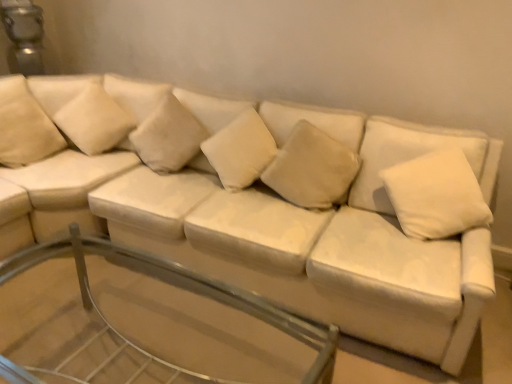
Question: Does suede-like beige pillow at upper left, the 1th pillow when ordered from left to right, appear on the left side of white soft cushion at upper left, the 5th pillow viewed from the right?

Choices:
 (A) yes
 (B) no

Answer: (A)

Question: Can you confirm if suede-like beige pillow at upper left, the 1th pillow when ordered from left to right, is taller than white soft cushion at upper left, the 5th pillow viewed from the right?

Choices:
 (A) no
 (B) yes

Answer: (B)

Question: Is suede-like beige pillow at upper left, the 1th pillow when ordered from left to right, positioned behind white soft cushion at upper left, marked as the second pillow in a left-to-right arrangement?

Choices:
 (A) yes
 (B) no

Answer: (B)

Question: Can you confirm if suede-like beige pillow at upper left, which is the 6th pillow in right-to-left order, is smaller than white soft cushion at upper left, the 5th pillow viewed from the right?

Choices:
 (A) no
 (B) yes

Answer: (B)

Question: Can you confirm if suede-like beige pillow at upper left, which is the 6th pillow in right-to-left order, is shorter than white soft cushion at upper left, the 5th pillow viewed from the right?

Choices:
 (A) yes
 (B) no

Answer: (B)

Question: From a real-world perspective, is suede-like beige pillow at upper left, which is the 6th pillow in right-to-left order, located higher than white soft cushion at upper left, the 5th pillow viewed from the right?

Choices:
 (A) yes
 (B) no

Answer: (B)

Question: Is white soft pillow at upper right, the 6th pillow viewed from the left, positioned with its back to suede-like beige pillow at upper left, the 1th pillow when ordered from left to right?

Choices:
 (A) no
 (B) yes

Answer: (A)

Question: Is the position of white soft pillow at upper right, acting as the 1th pillow starting from the right, more distant than that of suede-like beige pillow at upper left, the 1th pillow when ordered from left to right?

Choices:
 (A) yes
 (B) no

Answer: (B)

Question: Does white soft pillow at upper right, the 6th pillow viewed from the left, have a smaller size compared to suede-like beige pillow at upper left, the 1th pillow when ordered from left to right?

Choices:
 (A) no
 (B) yes

Answer: (A)

Question: Considering the relative sizes of white soft pillow at upper right, acting as the 1th pillow starting from the right, and suede-like beige pillow at upper left, which is the 6th pillow in right-to-left order, in the image provided, is white soft pillow at upper right, acting as the 1th pillow starting from the right, shorter than suede-like beige pillow at upper left, which is the 6th pillow in right-to-left order,?

Choices:
 (A) yes
 (B) no

Answer: (A)

Question: Does white soft pillow at upper right, acting as the 1th pillow starting from the right, have a lesser width compared to suede-like beige pillow at upper left, which is the 6th pillow in right-to-left order?

Choices:
 (A) yes
 (B) no

Answer: (B)

Question: Considering the relative sizes of white soft pillow at upper right, acting as the 1th pillow starting from the right, and suede-like beige pillow at upper left, which is the 6th pillow in right-to-left order, in the image provided, is white soft pillow at upper right, acting as the 1th pillow starting from the right, bigger than suede-like beige pillow at upper left, which is the 6th pillow in right-to-left order,?

Choices:
 (A) no
 (B) yes

Answer: (B)

Question: Can you confirm if white soft cushion at upper left, the 5th pillow viewed from the right, is thinner than white soft cushion at center, which ranks as the fourth pillow in left-to-right order?

Choices:
 (A) yes
 (B) no

Answer: (A)